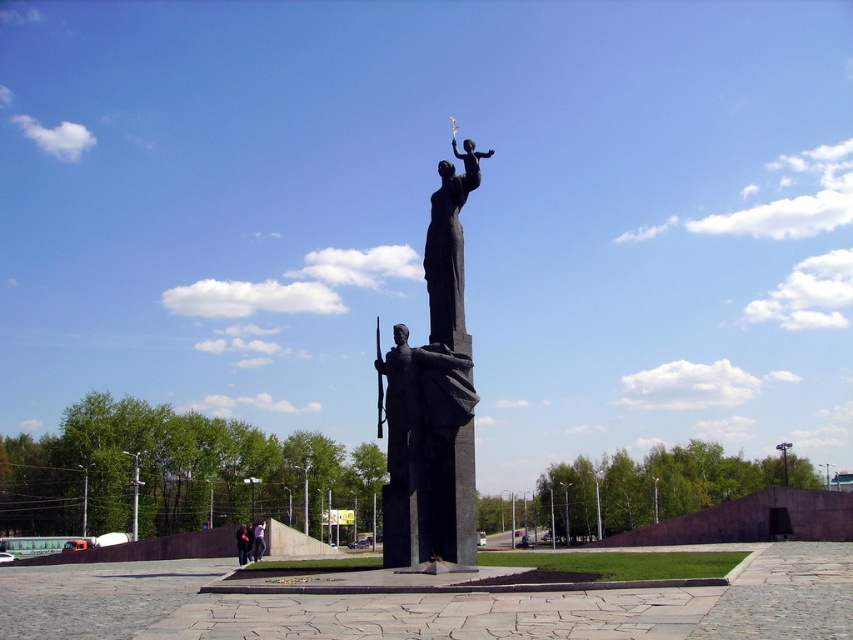
You are standing in front of the statue and want to know how far the point at coordinates (421, 394) is from you. Can you determine the distance?

The point at coordinates (421, 394) is 44.96 meters away from you.

You are an art student analyzing the statue in the public square. You notice two statues described as the black polished statue at center and the polished bronze statue at center. Which one takes up more area in the image?

The polished bronze statue at center takes up more area in the image because it occupies more space than the black polished statue at center.

You are standing at the base of the statue and want to take a photo of the point labeled as point [453,220]. Based on the distance between you and the point, can you estimate whether you need to use a zoom lens to capture the entire statue in your shot?

The point labeled point [453,220] is 48.01 meters away from the camera. Since you are at the base of the statue, which is likely positioned at a distance, using a zoom lens would help capture the entire statue in your shot.